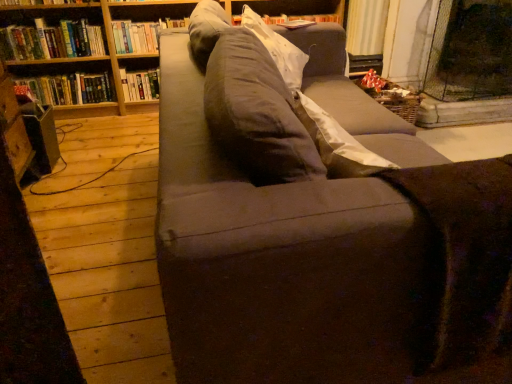
Question: Is hardcover book at upper left, which appears as the 2th book when viewed from the left, in front of or behind hardcover book at upper left, the third book in the left-to-right sequence, in the image?

Choices:
 (A) front
 (B) behind

Answer: (A)

Question: Considering the relative positions of hardcover book at upper left, which appears as the 2th book when viewed from the left, and hardcover book at upper left, the third book in the left-to-right sequence, in the image provided, is hardcover book at upper left, which appears as the 2th book when viewed from the left, to the left or to the right of hardcover book at upper left, the third book in the left-to-right sequence,?

Choices:
 (A) left
 (B) right

Answer: (A)

Question: Which object is positioned farthest from the wooden bookcase at upper left?

Choices:
 (A) hardcover book at upper left, which is the second book in right-to-left order
 (B) hardcover book at upper left, which is the fourth book from left to right
 (C) dark gray fabric couch at center
 (D) hardcover book at upper left, which appears as the 2th book when viewed from the left
 (E) gray fabric pillow at upper center

Answer: (C)

Question: Which object is the closest to the hardcover book at upper left, the third book viewed from the right?

Choices:
 (A) dark gray fabric couch at center
 (B) wooden bookcase at upper left
 (C) gray fabric pillow at upper center
 (D) hardcover book at left, the fourth book when ordered from right to left
 (E) hardcover book at upper left, which is the fourth book from left to right

Answer: (B)